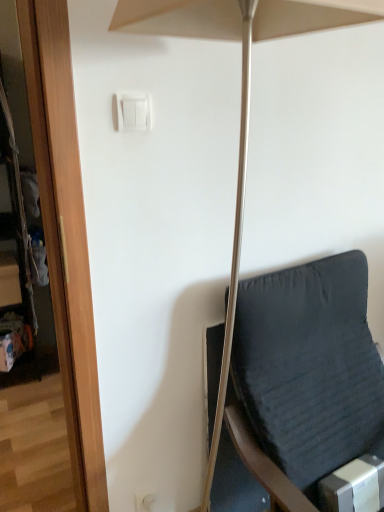
Where is `dark fabric chair at right`? dark fabric chair at right is located at coordinates (309, 368).

What do you see at coordinates (241, 88) in the screenshot? I see `matte beige umbrella at center` at bounding box center [241, 88].

Find the location of `dark fabric chair at right`. dark fabric chair at right is located at coordinates (309, 368).

Is dark fabric chair at right touching matte beige umbrella at center?

There is a gap between dark fabric chair at right and matte beige umbrella at center.

Is dark fabric chair at right bigger than matte beige umbrella at center?

Yes.

In the image, is dark fabric chair at right on the left side or the right side of matte beige umbrella at center?

dark fabric chair at right is to the right of matte beige umbrella at center.

Considering the sizes of objects matte beige umbrella at center and dark fabric chair at right in the image provided, who is smaller, matte beige umbrella at center or dark fabric chair at right?

With smaller size is matte beige umbrella at center.

Find the location of `furniture that appears behind the matte beige umbrella at center`. furniture that appears behind the matte beige umbrella at center is located at coordinates [309, 368].

Is matte beige umbrella at center next to dark fabric chair at right?

There is a gap between matte beige umbrella at center and dark fabric chair at right.

Does point (190, 33) appear closer or farther from the camera than point (336, 445)?

Clearly, point (190, 33) is closer to the camera than point (336, 445).

What's the angular difference between white plastic light switch at upper center and matte beige umbrella at center's facing directions?

6.02 degrees.

Is white plastic light switch at upper center far from matte beige umbrella at center?

No.

From a real-world perspective, does white plastic light switch at upper center sit lower than matte beige umbrella at center?

Incorrect, from a real-world perspective, white plastic light switch at upper center is higher than matte beige umbrella at center.

Is matte beige umbrella at center positioned with its back to white plastic light switch at upper center?

Yes, matte beige umbrella at center is positioned with its back facing white plastic light switch at upper center.

Considering the sizes of objects matte beige umbrella at center and white plastic light switch at upper center in the image provided, who is thinner, matte beige umbrella at center or white plastic light switch at upper center?

With smaller width is white plastic light switch at upper center.

Can you confirm if matte beige umbrella at center is positioned to the left of white plastic light switch at upper center?

In fact, matte beige umbrella at center is to the right of white plastic light switch at upper center.

Is matte beige umbrella at center positioned in front of white plastic light switch at upper center?

Result: Yes, matte beige umbrella at center is closer to the camera.

Is white plastic light switch at upper center positioned beyond the bounds of dark fabric chair at right?

Yes.

From the picture: Considering the positions of objects white plastic light switch at upper center and dark fabric chair at right in the image provided, who is more to the right, white plastic light switch at upper center or dark fabric chair at right?

Positioned to the right is dark fabric chair at right.

This screenshot has height=512, width=384. I want to click on furniture to the right of white plastic light switch at upper center, so click(309, 368).

How much distance is there between white plastic light switch at upper center and dark fabric chair at right?

A distance of 34.38 inches exists between white plastic light switch at upper center and dark fabric chair at right.

In the image, there is a white plastic light switch at upper center. Where is `furniture below it (from the image's perspective)`? furniture below it (from the image's perspective) is located at coordinates (309, 368).

How different are the orientations of dark fabric chair at right and white plastic light switch at upper center in degrees?

They differ by 5.91 degrees in their facing directions.

Between dark fabric chair at right and white plastic light switch at upper center, which one appears on the right side from the viewer's perspective?

From the viewer's perspective, dark fabric chair at right appears more on the right side.

Consider the image. Can white plastic light switch at upper center be found inside dark fabric chair at right?

No, white plastic light switch at upper center is not inside dark fabric chair at right.

Identify the location of furniture lying on the right of matte beige umbrella at center. (309, 368).

Locate an element on the screen. This screenshot has width=384, height=512. umbrella on the left side of dark fabric chair at right is located at coordinates (241, 88).

Considering their positions, is white plastic light switch at upper center positioned closer to matte beige umbrella at center than dark fabric chair at right?

white plastic light switch at upper center is closer to matte beige umbrella at center.

From the image, which object appears to be farther from white plastic light switch at upper center, dark fabric chair at right or matte beige umbrella at center?

dark fabric chair at right lies further to white plastic light switch at upper center than the other object.

Which object lies nearer to the anchor point dark fabric chair at right, white plastic light switch at upper center or matte beige umbrella at center?

The object closer to dark fabric chair at right is matte beige umbrella at center.

From the image, which object appears to be farther from dark fabric chair at right, matte beige umbrella at center or white plastic light switch at upper center?

The object further to dark fabric chair at right is white plastic light switch at upper center.

When comparing their distances from matte beige umbrella at center, does dark fabric chair at right or white plastic light switch at upper center seem closer?

white plastic light switch at upper center is positioned closer to the anchor matte beige umbrella at center.

When comparing their distances from white plastic light switch at upper center, does matte beige umbrella at center or dark fabric chair at right seem further?

Among the two, dark fabric chair at right is located further to white plastic light switch at upper center.

Image resolution: width=384 pixels, height=512 pixels. Find the location of `umbrella between white plastic light switch at upper center and dark fabric chair at right in the vertical direction`. umbrella between white plastic light switch at upper center and dark fabric chair at right in the vertical direction is located at coordinates (241, 88).